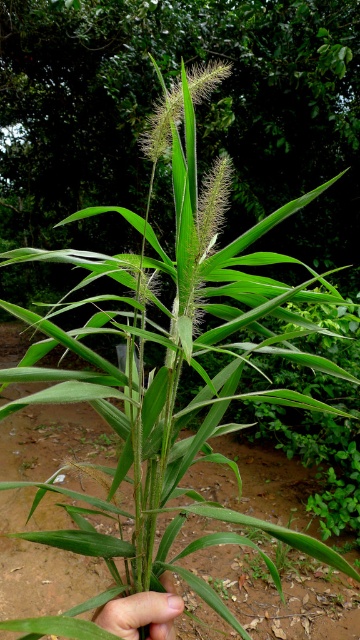
Can you confirm if skinny green leaf at center is positioned above brown soil at center?

Yes, skinny green leaf at center is above brown soil at center.

Does point (135, 625) lie in front of point (2, 460)?

Yes, point (135, 625) is in front of point (2, 460).

Find the location of a particular element. This screenshot has width=360, height=640. skinny green leaf at center is located at coordinates coord(142,612).

This screenshot has width=360, height=640. Identify the location of skinny green leaf at center. (142, 612).

Between point (138, 125) and point (150, 600), which one is positioned behind?

The point (138, 125) is behind.

Does green leafy plant at center appear on the right side of skinny green leaf at center?

Correct, you'll find green leafy plant at center to the right of skinny green leaf at center.

Between point (273, 92) and point (181, 609), which one is positioned behind?

The point (273, 92) is more distant.

This screenshot has height=640, width=360. Find the location of `green leafy plant at center`. green leafy plant at center is located at coordinates (196, 113).

Is green leafy plant at center thinner than brown soil at center?

Indeed, green leafy plant at center has a lesser width compared to brown soil at center.

Does green leafy plant at center appear on the left side of brown soil at center?

Incorrect, green leafy plant at center is not on the left side of brown soil at center.

This screenshot has width=360, height=640. I want to click on green leafy plant at center, so click(196, 113).

Locate an element on the screen. green leafy plant at center is located at coordinates (196, 113).